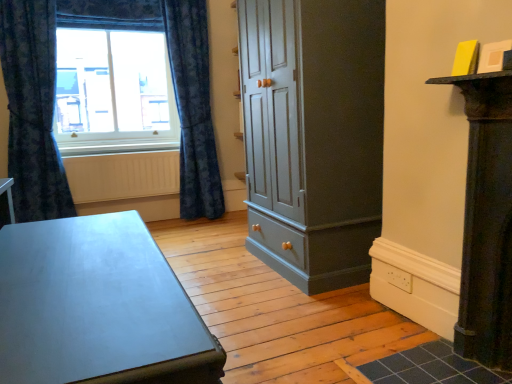
Question: From the image's perspective, is matte gray cupboard at center positioned above or below matte glass window at upper left?

Choices:
 (A) below
 (B) above

Answer: (A)

Question: Is matte gray cupboard at center to the left or to the right of matte glass window at upper left in the image?

Choices:
 (A) left
 (B) right

Answer: (B)

Question: Which is nearer to the matte gray cupboard at center?

Choices:
 (A) matte glass window at upper left
 (B) blue textured curtain at left, the 2th curtain when ordered from left to right
 (C) white textured radiator at lower left
 (D) matte gray table at lower left
 (E) dark blue textured curtain at left, which is the 1th curtain from left to right

Answer: (D)

Question: Based on their relative distances, which object is farther from the matte glass window at upper left?

Choices:
 (A) dark blue textured curtain at left, which appears as the 2th curtain when viewed from the right
 (B) matte gray table at lower left
 (C) blue textured curtain at left, the 2th curtain when ordered from left to right
 (D) white textured radiator at lower left
 (E) matte gray cupboard at center

Answer: (B)